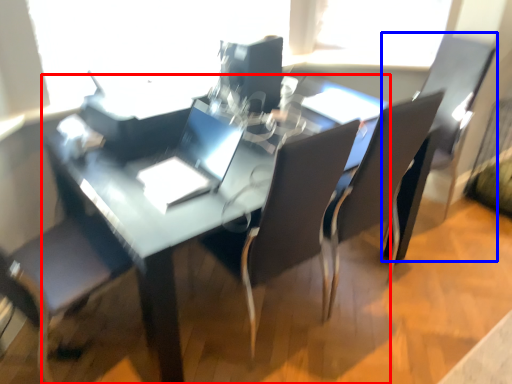
Question: Among these objects, which one is farthest to the camera, table (highlighted by a red box) or armchair (highlighted by a blue box)?

Choices:
 (A) table
 (B) armchair

Answer: (B)